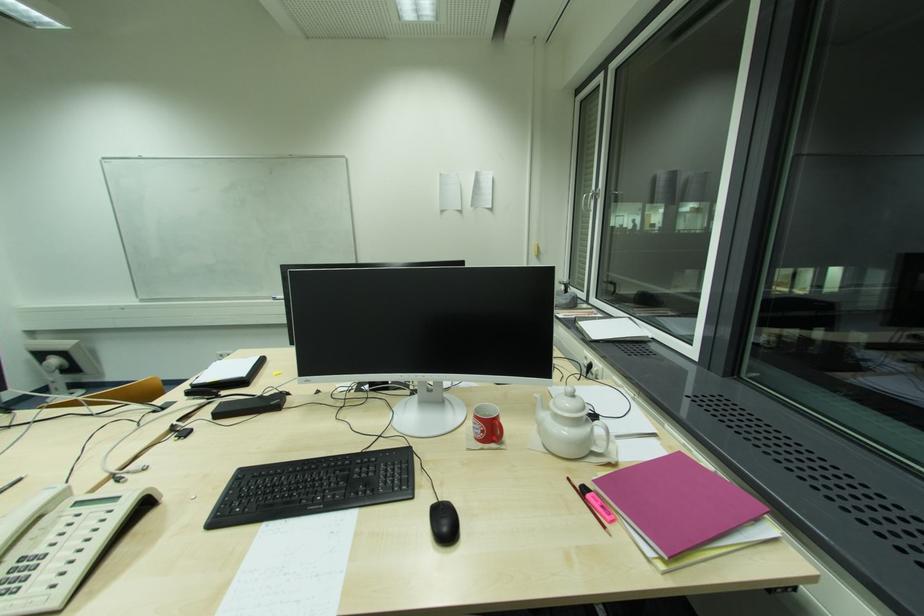
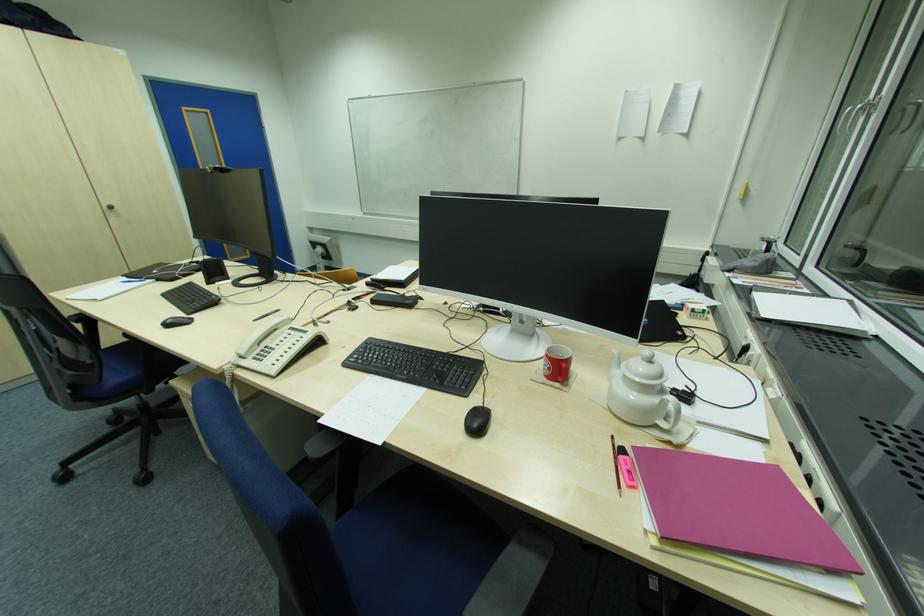
Question: The first image is from the beginning of the video and the second image is from the end. How did the camera likely rotate when shooting the video?

Choices:
 (A) Left
 (B) Right
 (C) Up
 (D) Down

Answer: (A)